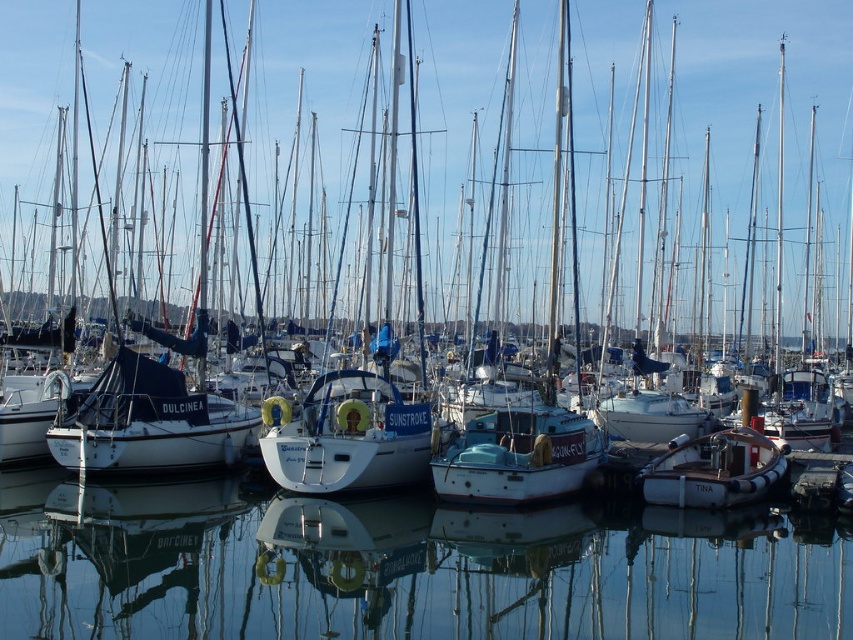
Can you confirm if white matte boat at center is positioned below wooden dinghy at center?

Incorrect, white matte boat at center is not positioned below wooden dinghy at center.

Does white matte boat at center come in front of wooden dinghy at center?

That is True.

Find the location of a particular element. The width and height of the screenshot is (853, 640). white matte boat at center is located at coordinates (518, 456).

Where is `white matte boat at center`? The height and width of the screenshot is (640, 853). white matte boat at center is located at coordinates coord(518,456).

Looking at this image, is white glossy sailboat at center smaller than white matte boat at center?

Yes, white glossy sailboat at center is smaller than white matte boat at center.

Which is more to the right, white glossy sailboat at center or white matte boat at center?

white matte boat at center

Is point (320, 419) positioned after point (567, 460)?

Yes, point (320, 419) is behind point (567, 460).

Identify the location of white glossy sailboat at center. This screenshot has height=640, width=853. (346, 436).

Is point (302, 477) positioned behind point (573, 426)?

No.

Is the position of white matte sailboat at center less distant than that of white matte boat at center?

No, it is behind white matte boat at center.

Which is in front, point (413, 365) or point (537, 499)?

Point (537, 499)

The width and height of the screenshot is (853, 640). Find the location of `white matte sailboat at center`. white matte sailboat at center is located at coordinates (350, 429).